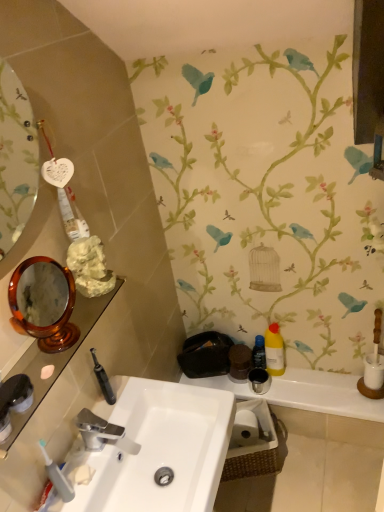
Image resolution: width=384 pixels, height=512 pixels. Find the location of `empty space that is to the right of yellow matte bottle at right, placed as the 2th mouthwash when sorted from left to right`. empty space that is to the right of yellow matte bottle at right, placed as the 2th mouthwash when sorted from left to right is located at coordinates (319, 376).